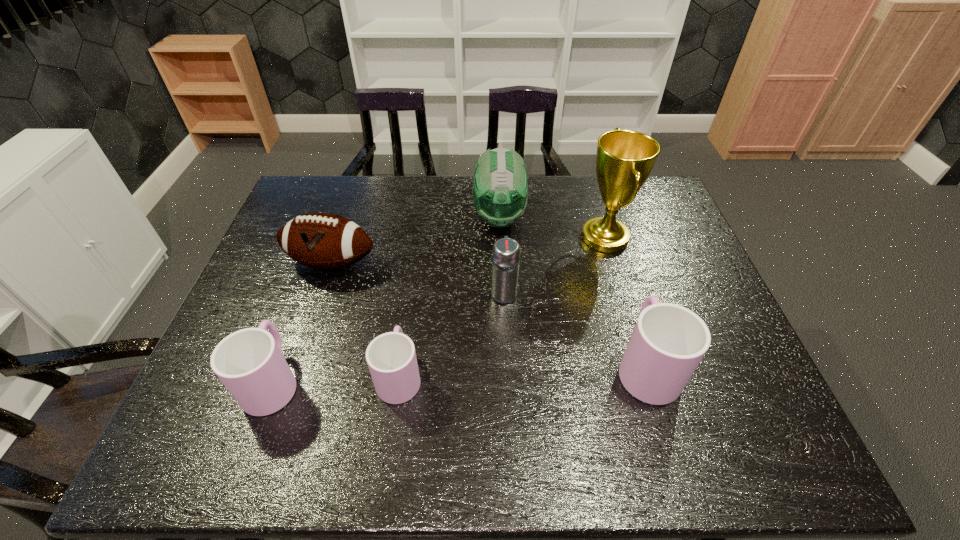
Find the location of `vacant area situated with the handle on the side of the leftmost cup`. vacant area situated with the handle on the side of the leftmost cup is located at coordinates (302, 301).

Find the location of a particular element. The image size is (960, 540). free region located 0.380m with the handle on the side of the shortest object is located at coordinates (419, 245).

This screenshot has height=540, width=960. I want to click on vacant space positioned 0.110m with the handle on the side of the shortest object, so click(x=409, y=313).

The width and height of the screenshot is (960, 540). Find the location of `free spot located with the handle on the side of the shortest object`. free spot located with the handle on the side of the shortest object is located at coordinates (418, 251).

Where is `blank space located with the handle on the side of the rightmost cup`? The width and height of the screenshot is (960, 540). blank space located with the handle on the side of the rightmost cup is located at coordinates (631, 314).

Find the location of a particular element. This screenshot has width=960, height=540. free space located 0.190m with the handle on the side of the rightmost cup is located at coordinates (618, 276).

Where is `vacant space located with the handle on the side of the rightmost cup`? The height and width of the screenshot is (540, 960). vacant space located with the handle on the side of the rightmost cup is located at coordinates (608, 241).

Find the location of a particular element. The width and height of the screenshot is (960, 540). vacant space located 0.200m on the visor of the sixth shortest object is located at coordinates (503, 288).

You are a GUI agent. You are given a task and a screenshot of the screen. Output one action in this format:
    pyautogui.click(x=<x>, y=<y>)
    Task: Click on the free space located 0.180m by the handles of the award
    The width and height of the screenshot is (960, 540).
    Given the screenshot: What is the action you would take?
    pyautogui.click(x=520, y=238)

The height and width of the screenshot is (540, 960). I want to click on free space located by the handles of the award, so click(x=520, y=238).